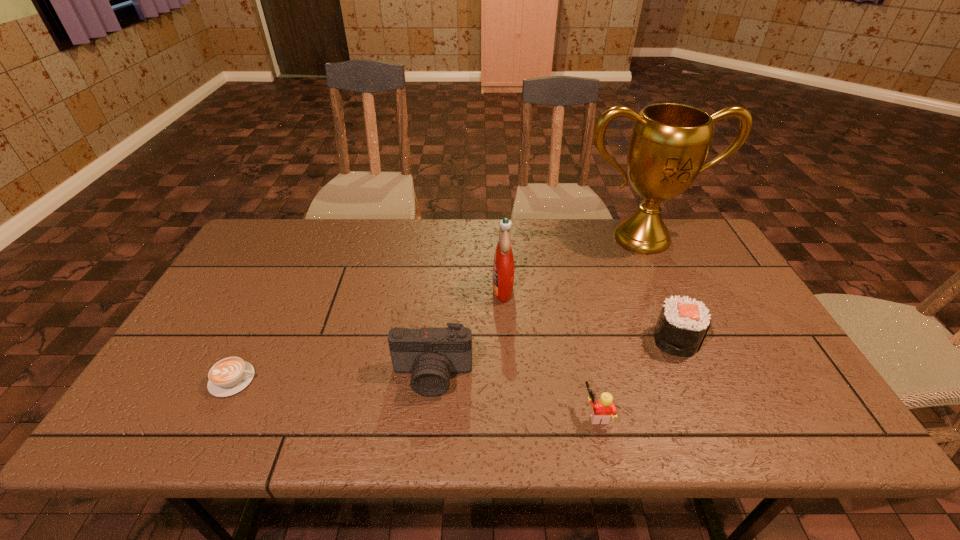
Find the location of a particular element. The width and height of the screenshot is (960, 540). object present at the far edge is located at coordinates (669, 144).

Identify the location of object present at the near edge. This screenshot has width=960, height=540. (604, 407).

You are a GUI agent. You are given a task and a screenshot of the screen. Output one action in this format:
    pyautogui.click(x=<x>, y=<y>)
    Task: Click on the object present at the left edge
    This screenshot has width=960, height=540.
    Given the screenshot: What is the action you would take?
    pos(228,376)

The height and width of the screenshot is (540, 960). Identify the location of object that is positioned at the right edge. (669, 144).

Locate an element on the screen. The image size is (960, 540). object that is at the far right corner is located at coordinates (669, 144).

Where is `vacant area at the far edge of the desktop`? The image size is (960, 540). vacant area at the far edge of the desktop is located at coordinates (407, 245).

Image resolution: width=960 pixels, height=540 pixels. What are the coordinates of `blank space at the near edge of the desktop` in the screenshot? It's located at (748, 410).

Where is `blank space at the right edge`? This screenshot has height=540, width=960. blank space at the right edge is located at coordinates (732, 286).

In the image, there is a desktop. In order to click on vacant space at the far right corner in this screenshot , I will do `click(670, 247)`.

Where is `vacant space in between the tallest object and the fourth object from right to left`? vacant space in between the tallest object and the fourth object from right to left is located at coordinates (572, 263).